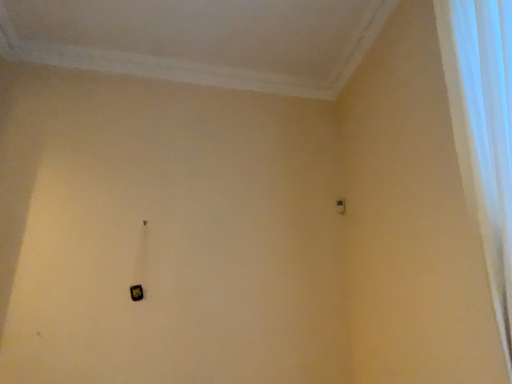
Image resolution: width=512 pixels, height=384 pixels. What do you see at coordinates (484, 130) in the screenshot?
I see `white textured curtain at right` at bounding box center [484, 130].

Where is `white textured curtain at right`? white textured curtain at right is located at coordinates (484, 130).

Locate an element on the screen. The width and height of the screenshot is (512, 384). white textured curtain at right is located at coordinates (484, 130).